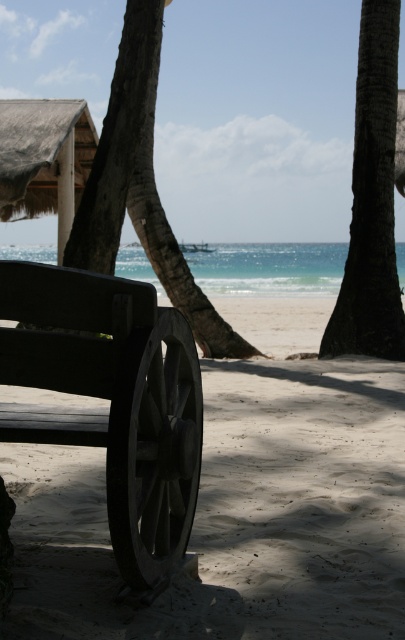
From the picture: You are standing at the edge of the beach and see the wooden bench at lower left and the sandy beige at lower left. Which one is positioned more to the right side?

The sandy beige at lower left is positioned to the right of the wooden bench at lower left, so it is more to the right side.

You are a photographer setting up equipment on the beach. You have a camera bag that needs to be placed between the sandy beige at lower left and the wooden wheel at lower left. Given that the distance between them is 31.26 inches, can you fit your camera bag which is 28 inches long without overlapping either object?

The sandy beige at lower left and wooden wheel at lower left are 31.26 inches apart. Since your camera bag is 28 inches long, it can fit between them without overlapping either object as there is enough space.